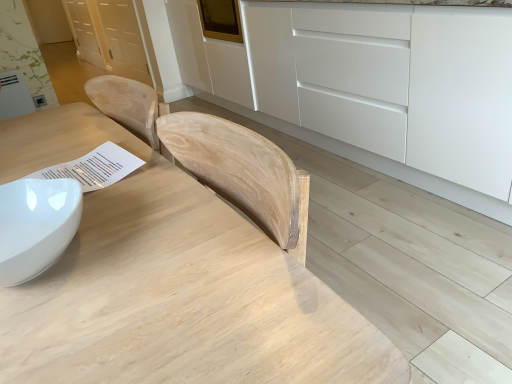
Question: From a real-world perspective, is white matte cabinet at center physically located above or below natural wood table at center?

Choices:
 (A) above
 (B) below

Answer: (B)

Question: Is white matte cabinet at center to the left or to the right of natural wood table at center in the image?

Choices:
 (A) left
 (B) right

Answer: (B)

Question: Considering the positions of white matte cabinet at center and natural wood table at center in the image, is white matte cabinet at center wider or thinner than natural wood table at center?

Choices:
 (A) wide
 (B) thin

Answer: (A)

Question: From the image's perspective, relative to white matte cabinet at center, is natural wood table at center above or below?

Choices:
 (A) above
 (B) below

Answer: (B)

Question: Is natural wood table at center in front of or behind white matte cabinet at center in the image?

Choices:
 (A) front
 (B) behind

Answer: (A)

Question: Considering the relative positions of natural wood table at center and white matte cabinet at center in the image provided, is natural wood table at center to the left or to the right of white matte cabinet at center?

Choices:
 (A) left
 (B) right

Answer: (A)

Question: Considering the positions of natural wood table at center and white matte cabinet at center in the image, is natural wood table at center taller or shorter than white matte cabinet at center?

Choices:
 (A) tall
 (B) short

Answer: (B)